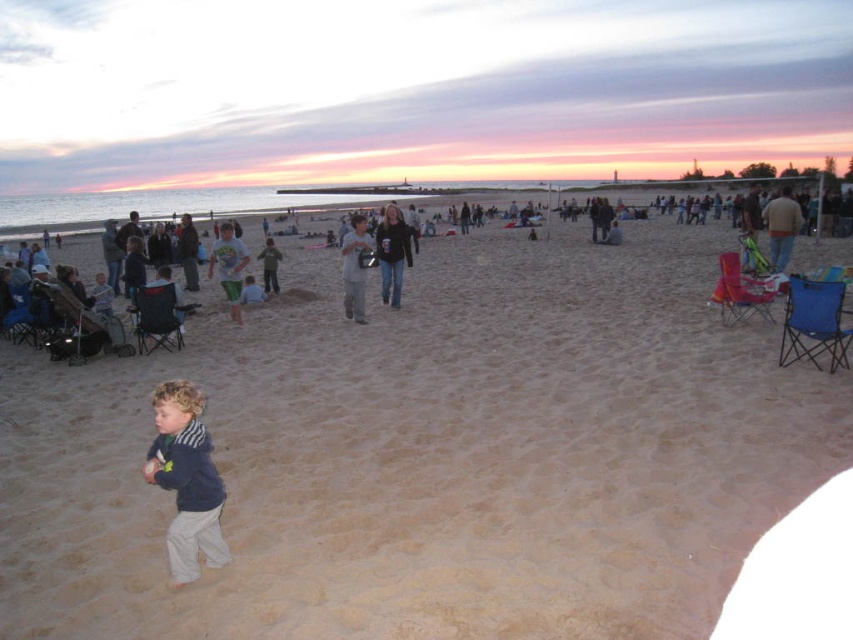
Who is more forward, (792, 429) or (386, 221)?

Positioned in front is point (792, 429).

This screenshot has height=640, width=853. I want to click on light beige sand at center, so click(x=430, y=456).

Between point (364, 320) and point (215, 248), which one is positioned behind?

The point (364, 320) is behind.

You are a GUI agent. You are given a task and a screenshot of the screen. Output one action in this format:
    pyautogui.click(x=<x>, y=<y>)
    Task: Click on the light gray cotton shirt at center
    The image size is (853, 640).
    Given the screenshot: What is the action you would take?
    pyautogui.click(x=354, y=268)

Where is `light gray cotton shirt at center`? The width and height of the screenshot is (853, 640). light gray cotton shirt at center is located at coordinates (354, 268).

Which is more to the left, white cotton shirt at center or camouflage pants at center?

From the viewer's perspective, white cotton shirt at center appears more on the left side.

Is point (233, 268) farther from viewer compared to point (271, 288)?

No, it is not.

Identify the location of white cotton shirt at center. The width and height of the screenshot is (853, 640). (228, 266).